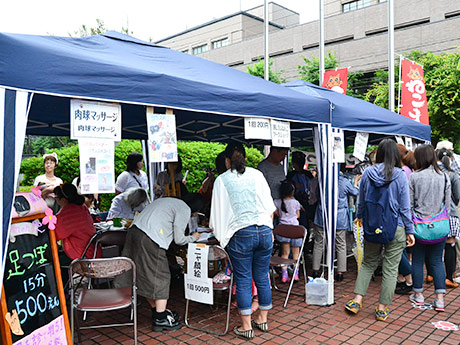
This screenshot has height=345, width=460. I want to click on metal folding chair, so click(102, 301), click(115, 238), click(219, 285), click(287, 260).